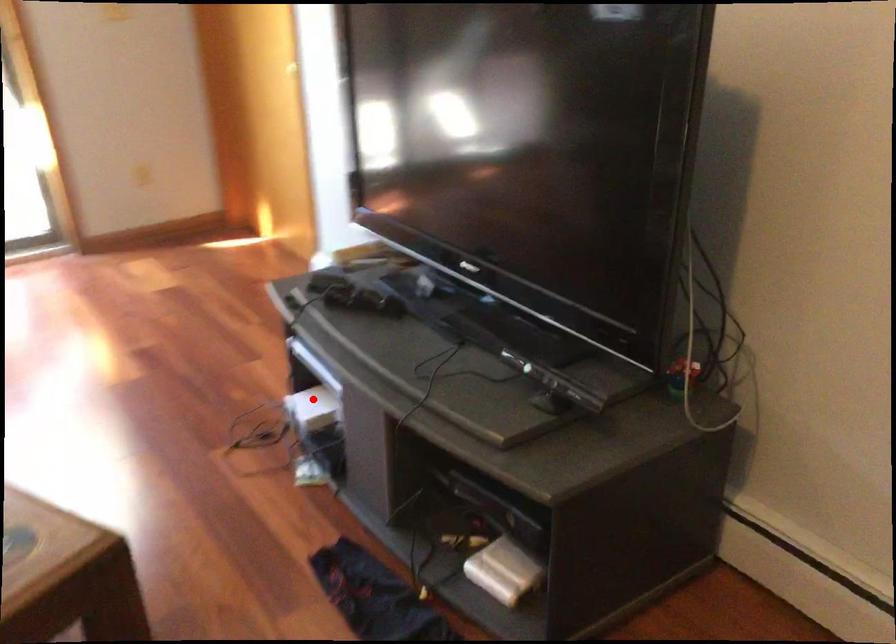
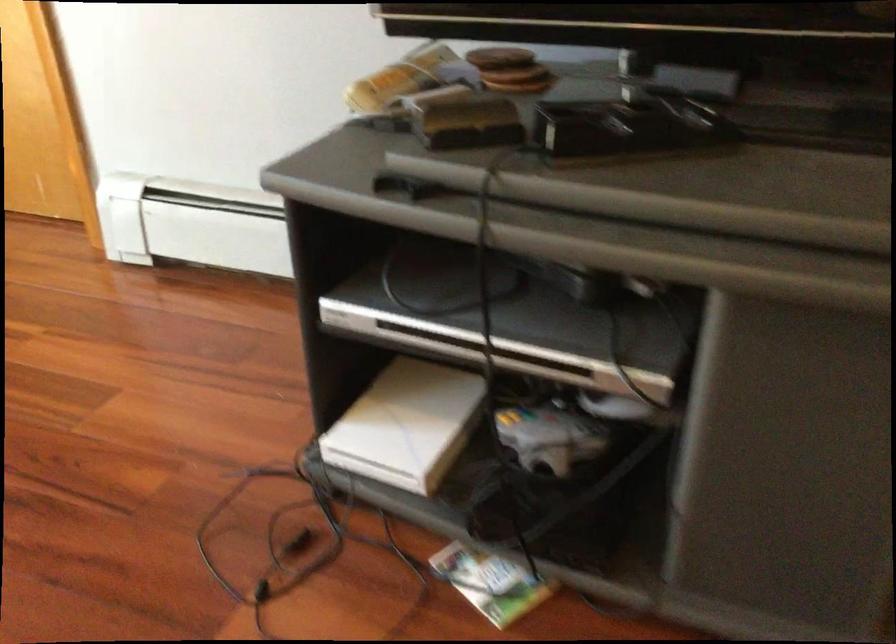
In the second image, find the point that corresponds to the highlighted location in the first image.

(407, 424)